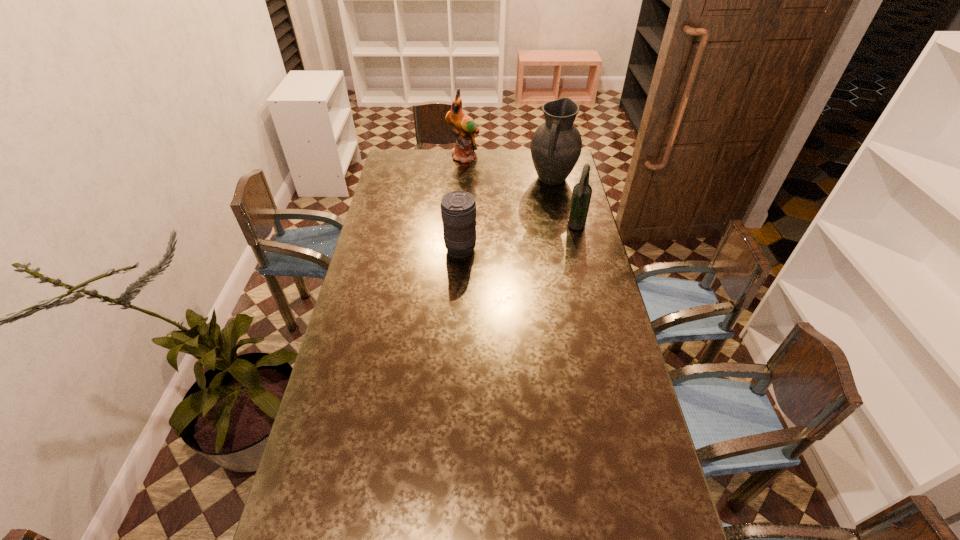
I want to click on object present at the far right corner, so click(556, 145).

The image size is (960, 540). In order to click on blank area at the near edge in this screenshot , I will do `click(599, 525)`.

In the image, there is a desktop. Identify the location of free space at the left edge. (401, 208).

The width and height of the screenshot is (960, 540). In order to click on vacant space at the right edge in this screenshot , I will do tap(617, 385).

Locate an element on the screen. vacant point at the far left corner is located at coordinates (417, 157).

You are a GUI agent. You are given a task and a screenshot of the screen. Output one action in this format:
    pyautogui.click(x=<x>, y=<y>)
    Task: Click on the free spot at the near left corner of the desktop
    The width and height of the screenshot is (960, 540).
    Given the screenshot: What is the action you would take?
    pyautogui.click(x=300, y=511)

You are a GUI agent. You are given a task and a screenshot of the screen. Output one action in this format:
    pyautogui.click(x=<x>, y=<y>)
    Task: Click on the vacant area that lies between the farthest object and the second nearest object
    The image size is (960, 540).
    Given the screenshot: What is the action you would take?
    pyautogui.click(x=520, y=192)

You are a GUI agent. You are given a task and a screenshot of the screen. Output one action in this format:
    pyautogui.click(x=<x>, y=<y>)
    Task: Click on the vacant area that lies between the second shortest object and the telephoto lens
    This screenshot has height=540, width=960.
    Given the screenshot: What is the action you would take?
    pyautogui.click(x=518, y=239)

This screenshot has width=960, height=540. I want to click on free space that is in between the farthest object and the third farthest object, so click(520, 192).

This screenshot has height=540, width=960. Find the location of `vacant area that lies between the third nearest object and the beer bottle`. vacant area that lies between the third nearest object and the beer bottle is located at coordinates (564, 203).